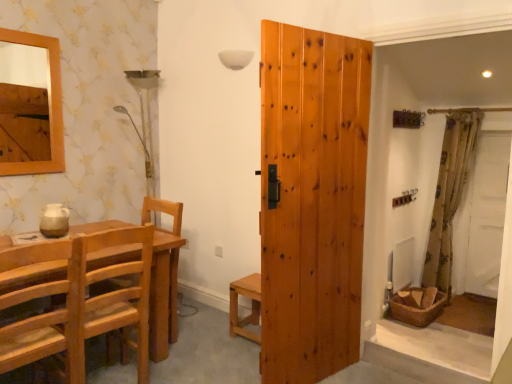
This screenshot has width=512, height=384. What are the coordinates of `free point above floral fabric curtain at right (from a real-world perspective)` in the screenshot? It's located at (462, 100).